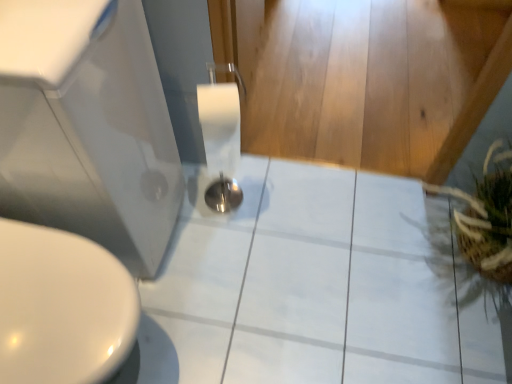
Question: From the image's perspective, relative to white glossy tile at center, is brown woven basket at right above or below?

Choices:
 (A) above
 (B) below

Answer: (A)

Question: Considering the positions of brown woven basket at right and white glossy tile at center in the image, is brown woven basket at right wider or thinner than white glossy tile at center?

Choices:
 (A) thin
 (B) wide

Answer: (A)

Question: Estimate the real-world distances between objects in this image. Which object is closer to the brown woven basket at right?

Choices:
 (A) white glossy sink at lower left
 (B) white glossy tile at center

Answer: (B)

Question: Considering the real-world distances, which object is closest to the brown woven basket at right?

Choices:
 (A) white glossy tile at center
 (B) white glossy sink at lower left

Answer: (A)